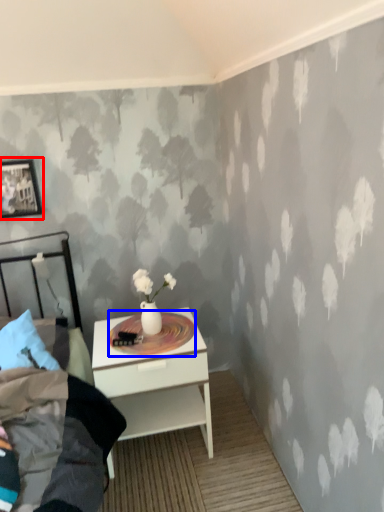
Question: Among these objects, which one is nearest to the camera, picture frame (highlighted by a red box) or round table (highlighted by a blue box)?

Choices:
 (A) picture frame
 (B) round table

Answer: (B)